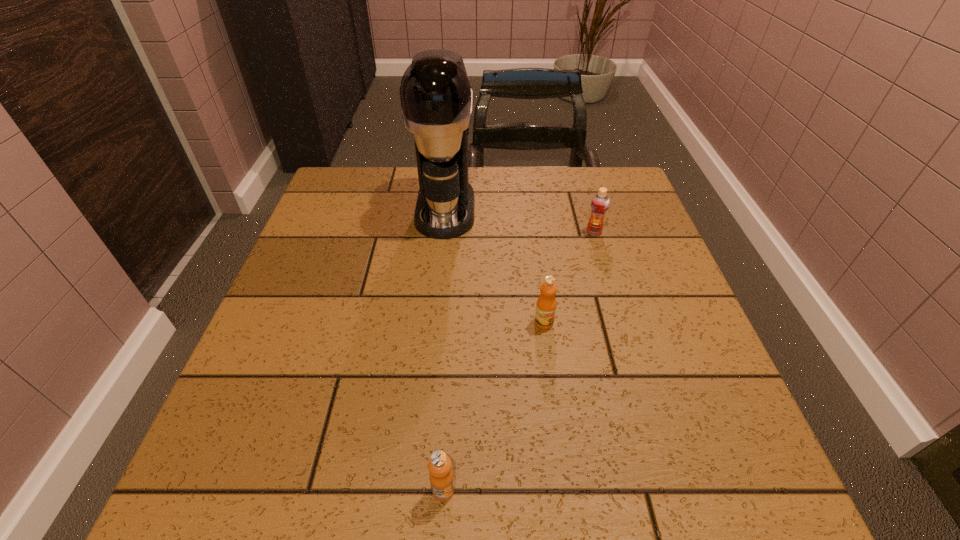
You are a GUI agent. You are given a task and a screenshot of the screen. Output one action in this format:
    pyautogui.click(x=<x>, y=<y>)
    Task: Click on the coffee maker
    This screenshot has width=960, height=540.
    Given the screenshot: What is the action you would take?
    pyautogui.click(x=436, y=98)

Identify the location of the farthest orange juice. The height and width of the screenshot is (540, 960). (600, 202).

At what (x,y) coordinates should I click in order to perform the action: click on the rightmost orange juice. Please return your answer as a coordinate pair (x, y). The image size is (960, 540). Looking at the image, I should click on (600, 202).

Where is `the second farthest orange juice`? The height and width of the screenshot is (540, 960). the second farthest orange juice is located at coordinates (546, 304).

Where is `the second orange juice from right to left`? This screenshot has width=960, height=540. the second orange juice from right to left is located at coordinates (546, 304).

I want to click on the leftmost orange juice, so click(441, 477).

This screenshot has width=960, height=540. I want to click on the nearest object, so (x=441, y=477).

This screenshot has width=960, height=540. I want to click on blank space located 0.090m place cup under the spout of the coffee maker, so click(x=440, y=265).

At what (x,y) coordinates should I click in order to perform the action: click on vacant space situated 0.230m on the front of the rightmost object. Please return your answer as a coordinate pair (x, y). The width and height of the screenshot is (960, 540). Looking at the image, I should click on (616, 307).

Find the location of a particular element. The height and width of the screenshot is (540, 960). vacant space situated on the front label of the second nearest orange juice is located at coordinates (548, 355).